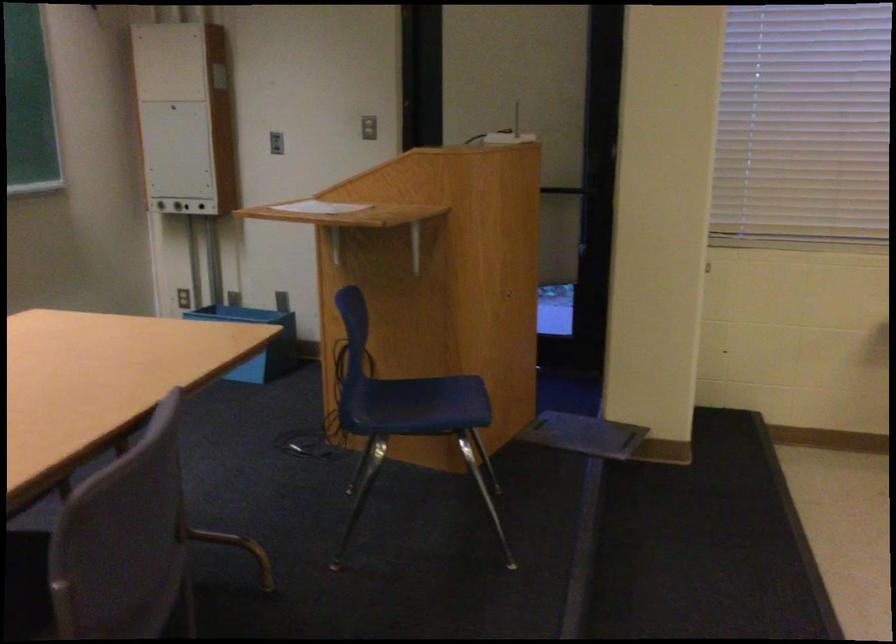
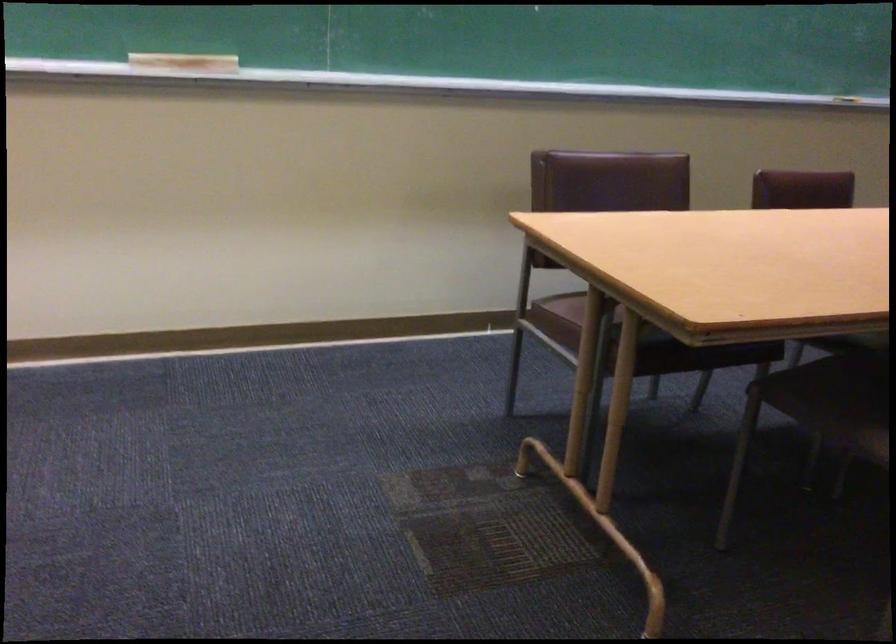
Question: The camera is either moving clockwise (left) or counter-clockwise (right) around the object. The first image is from the beginning of the video and the second image is from the end. Is the camera moving left or right when shooting the video?

Choices:
 (A) Left
 (B) Right

Answer: (B)